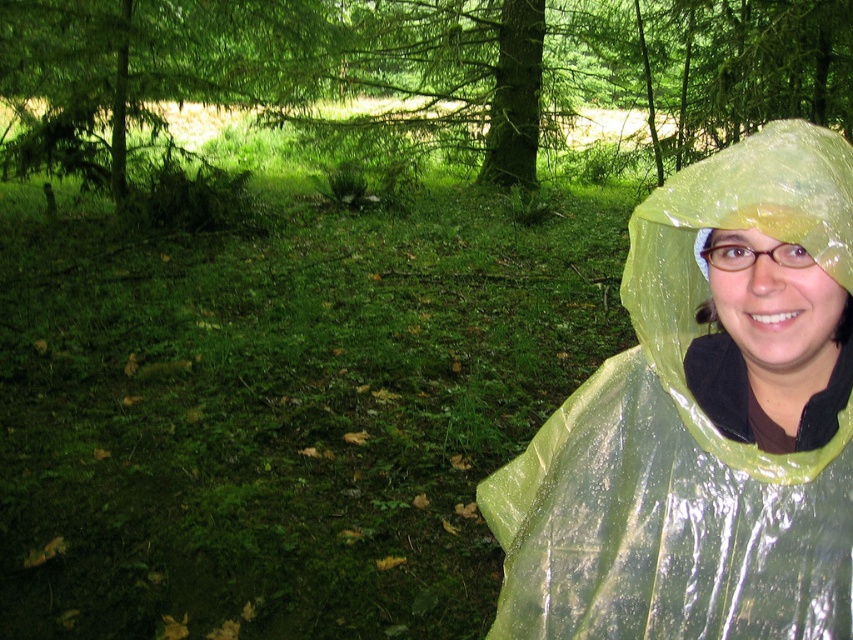
Question: Is transparent yellow raincoat at right smaller than green glossy tree at center?

Choices:
 (A) yes
 (B) no

Answer: (A)

Question: Does transparent yellow raincoat at right have a smaller size compared to green glossy tree at center?

Choices:
 (A) no
 (B) yes

Answer: (B)

Question: Which of the following is the farthest from the observer?

Choices:
 (A) green glossy tree at center
 (B) transparent yellow raincoat at right

Answer: (A)

Question: Does transparent yellow raincoat at right have a lesser width compared to green glossy tree at center?

Choices:
 (A) yes
 (B) no

Answer: (A)

Question: Which point is farther to the camera?

Choices:
 (A) green glossy tree at center
 (B) transparent yellow raincoat at right

Answer: (A)